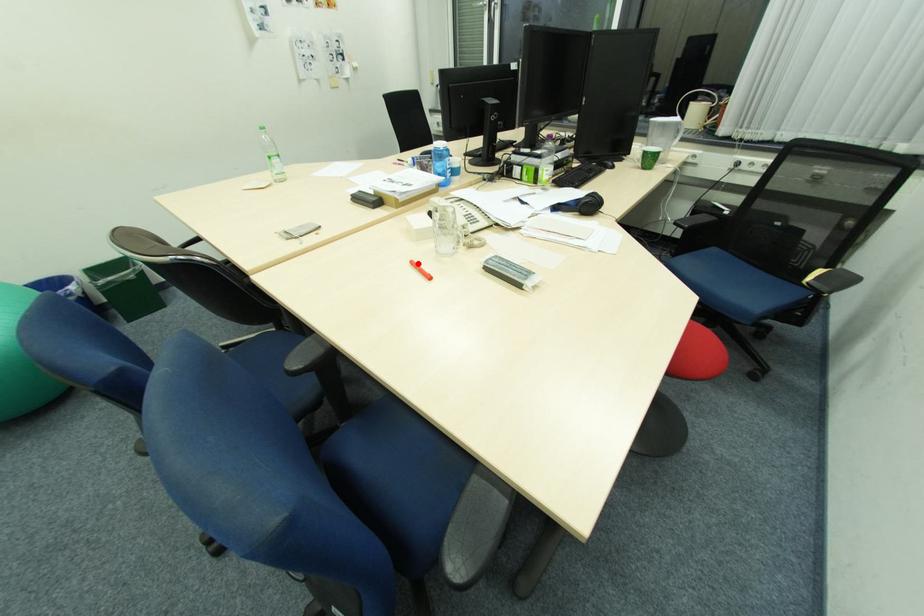
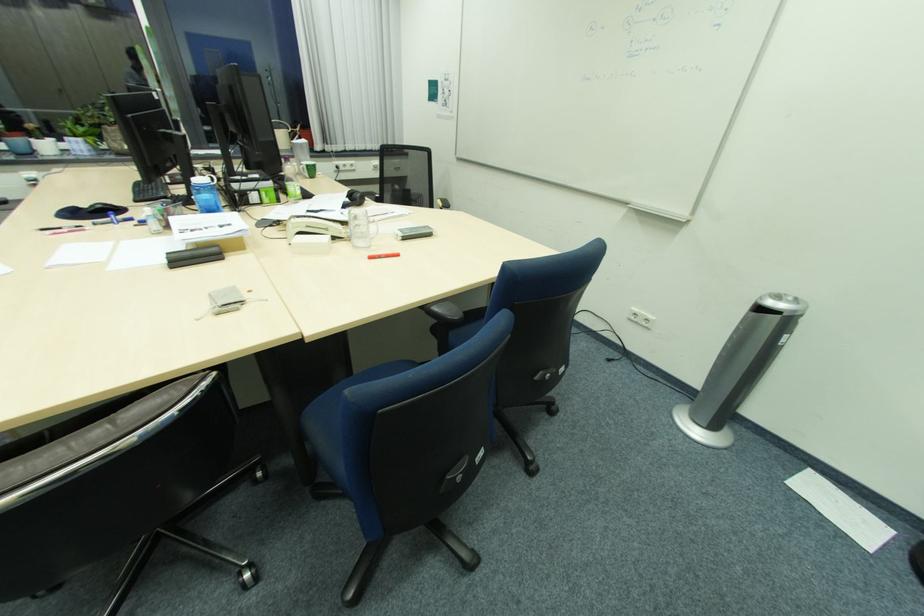
Question: I am providing you with two images of the same scene from different viewpoints. A red point is marked on the first image. At the location where the point appears in image 1, is it still visible in image 2?

Choices:
 (A) Yes
 (B) No

Answer: (A)